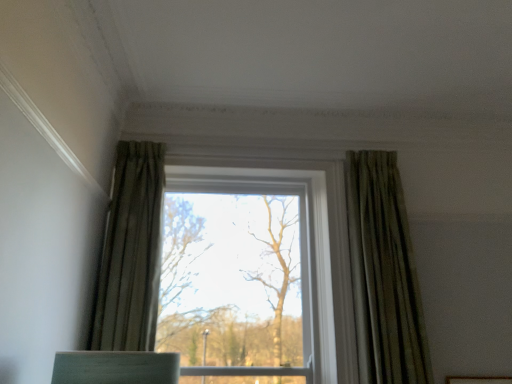
Question: Considering the relative positions of green textured curtain at left, which is the second curtain from right to left, and green textured curtain at right, which ranks as the 1th curtain in right-to-left order, in the image provided, is green textured curtain at left, which is the second curtain from right to left, to the left of green textured curtain at right, which ranks as the 1th curtain in right-to-left order, from the viewer's perspective?

Choices:
 (A) yes
 (B) no

Answer: (A)

Question: From the image's perspective, would you say green textured curtain at left, which is the second curtain from right to left, is shown under green textured curtain at right, which is the second curtain in left-to-right order?

Choices:
 (A) no
 (B) yes

Answer: (A)

Question: Is green textured curtain at left, the 1th curtain from the left, surrounding green textured curtain at right, which is the second curtain in left-to-right order?

Choices:
 (A) no
 (B) yes

Answer: (A)

Question: Does green textured curtain at left, which is the second curtain from right to left, turn towards green textured curtain at right, which is the second curtain in left-to-right order?

Choices:
 (A) yes
 (B) no

Answer: (B)

Question: Does green textured curtain at left, the 1th curtain from the left, have a lesser width compared to green textured curtain at right, which ranks as the 1th curtain in right-to-left order?

Choices:
 (A) yes
 (B) no

Answer: (B)

Question: Relative to green textured curtain at right, which ranks as the 1th curtain in right-to-left order, is green textured curtain at left, which is the second curtain from right to left, in front or behind?

Choices:
 (A) behind
 (B) front

Answer: (B)

Question: Is point (131, 183) positioned closer to the camera than point (395, 203)?

Choices:
 (A) closer
 (B) farther

Answer: (A)

Question: Is green textured curtain at left, the 1th curtain from the left, taller or shorter than green textured curtain at right, which is the second curtain in left-to-right order?

Choices:
 (A) tall
 (B) short

Answer: (B)

Question: From the image's perspective, relative to green textured curtain at right, which is the second curtain in left-to-right order, is green textured curtain at left, the 1th curtain from the left, above or below?

Choices:
 (A) above
 (B) below

Answer: (A)

Question: Considering the positions of clear glass window at center and green textured curtain at left, which is the second curtain from right to left, in the image, is clear glass window at center wider or thinner than green textured curtain at left, which is the second curtain from right to left,?

Choices:
 (A) thin
 (B) wide

Answer: (B)

Question: Is clear glass window at center inside or outside of green textured curtain at left, which is the second curtain from right to left?

Choices:
 (A) inside
 (B) outside

Answer: (B)

Question: From the image's perspective, is clear glass window at center located above or below green textured curtain at left, which is the second curtain from right to left?

Choices:
 (A) above
 (B) below

Answer: (B)

Question: Considering the positions of point (131, 182) and point (145, 221), is point (131, 182) closer or farther from the camera than point (145, 221)?

Choices:
 (A) closer
 (B) farther

Answer: (B)

Question: Looking at the image, does green textured curtain at right, which ranks as the 1th curtain in right-to-left order, seem bigger or smaller compared to clear glass window at center?

Choices:
 (A) big
 (B) small

Answer: (B)

Question: Is green textured curtain at right, which ranks as the 1th curtain in right-to-left order, wider or thinner than clear glass window at center?

Choices:
 (A) wide
 (B) thin

Answer: (B)